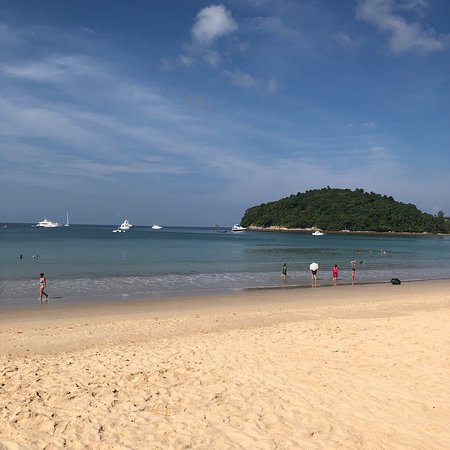
In order to click on foam in this screenshot , I will do `click(111, 286)`.